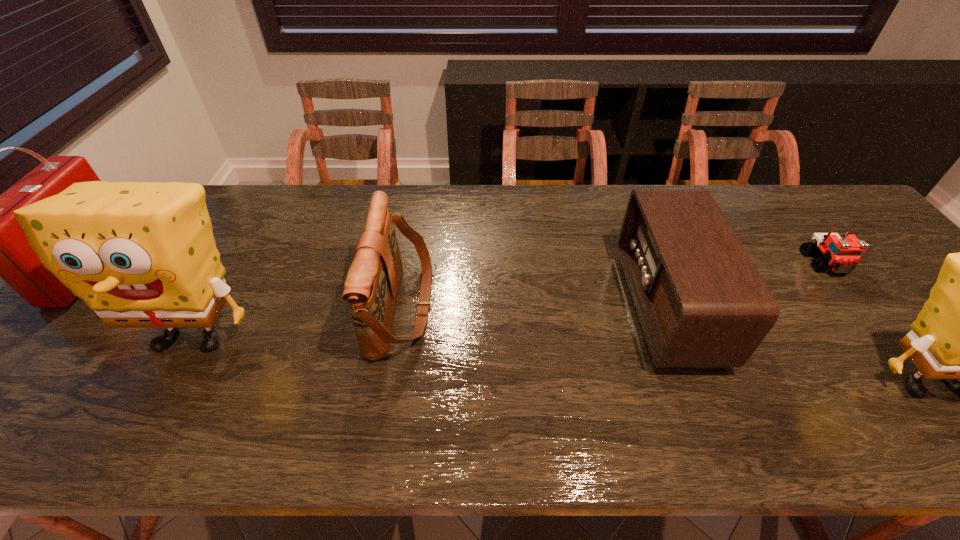
Image resolution: width=960 pixels, height=540 pixels. I want to click on blank space located 0.150m on the front-facing side of the third object from right to left, so click(x=569, y=306).

The image size is (960, 540). I want to click on blank space located 0.110m on the front-facing side of the fourth object from right to left, so click(476, 306).

Where is `free region located 0.080m on the front-facing side of the Lego`? This screenshot has height=540, width=960. free region located 0.080m on the front-facing side of the Lego is located at coordinates (855, 302).

Where is `object situated at the far edge`? object situated at the far edge is located at coordinates (0, 248).

This screenshot has width=960, height=540. I want to click on sponge at the near edge, so click(140, 255).

This screenshot has width=960, height=540. I want to click on radio receiver that is at the near edge, so click(701, 302).

Where is `shoulder bag that is at the near edge`? The height and width of the screenshot is (540, 960). shoulder bag that is at the near edge is located at coordinates (371, 287).

Locate an element on the screen. Image resolution: width=960 pixels, height=540 pixels. object that is positioned at the left edge is located at coordinates (0, 248).

Where is `object located in the right edge section of the desktop`? The height and width of the screenshot is (540, 960). object located in the right edge section of the desktop is located at coordinates (841, 255).

Where is `object at the far left corner`? object at the far left corner is located at coordinates (0, 248).